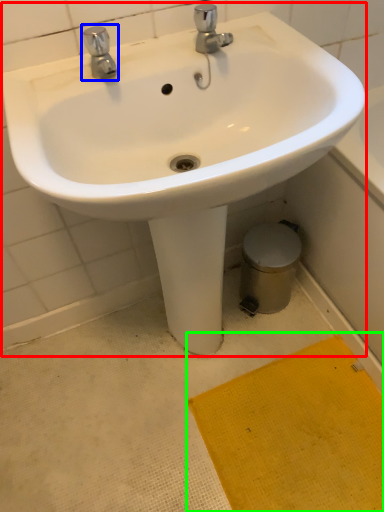
Question: Estimate the real-world distances between objects in this image. Which object is closer to sink (highlighted by a red box), tap (highlighted by a blue box) or doormat (highlighted by a green box)?

Choices:
 (A) tap
 (B) doormat

Answer: (A)